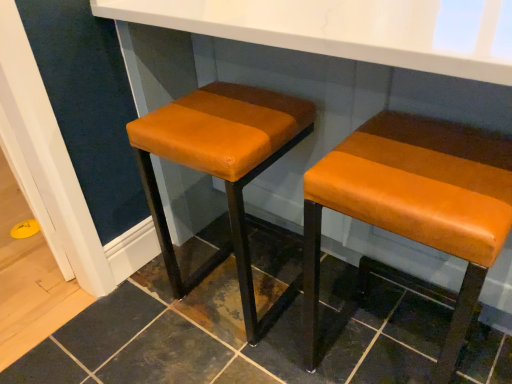
Identify the location of vacant space behind orange leather stool at center, which appears as the first stool when viewed from the left. This screenshot has height=384, width=512. [x=230, y=244].